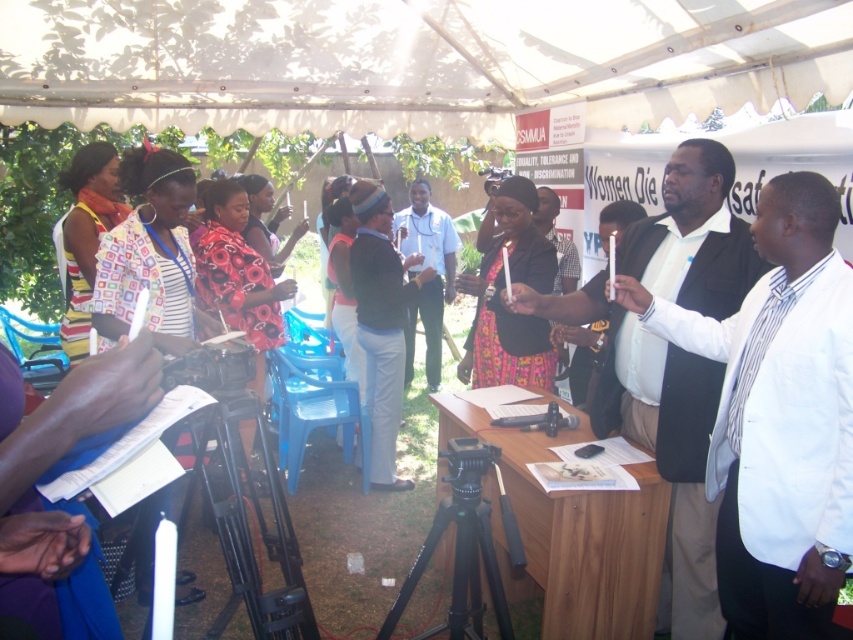
Question: Is knitted brown hat at center wider than light blue shirt at center?

Choices:
 (A) yes
 (B) no

Answer: (B)

Question: Does white glossy shirt at center have a larger size compared to knitted brown hat at center?

Choices:
 (A) yes
 (B) no

Answer: (B)

Question: Which point is closer to the camera?

Choices:
 (A) (357, 316)
 (B) (693, 436)
 (C) (405, 384)

Answer: (B)

Question: Can you confirm if knitted brown hat at center is positioned to the right of light blue shirt at center?

Choices:
 (A) yes
 (B) no

Answer: (B)

Question: Which of these objects is positioned farthest from the knitted brown hat at center?

Choices:
 (A) light blue shirt at center
 (B) white shirt at center

Answer: (B)

Question: Based on their relative distances, which object is nearer to the light blue shirt at center?

Choices:
 (A) white glossy shirt at center
 (B) knitted brown hat at center
 (C) white shirt at center

Answer: (B)